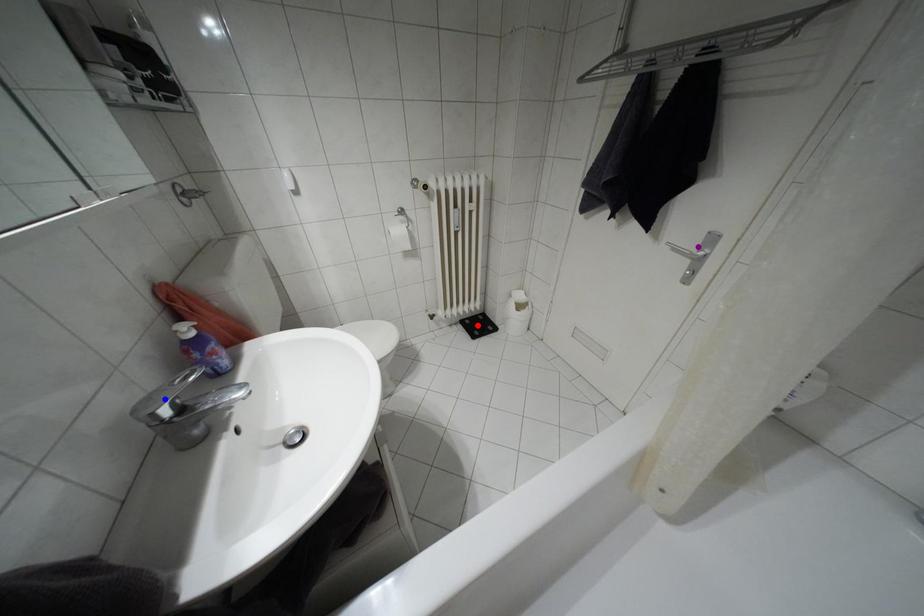
Order these from nearest to farthest:
red point
blue point
purple point

red point < purple point < blue point